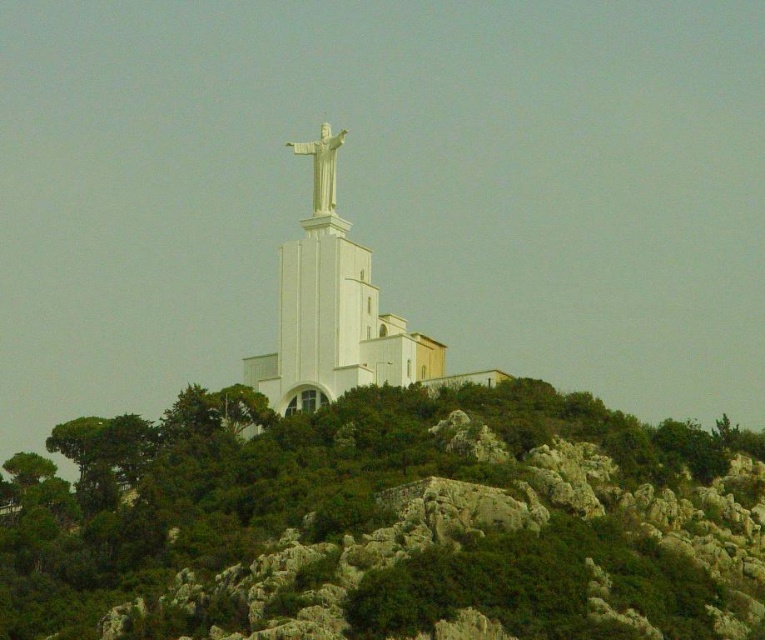
Question: Is white smooth statue at center below white marble statue at center?

Choices:
 (A) no
 (B) yes

Answer: (B)

Question: Which point is closer to the camera?

Choices:
 (A) white marble statue at center
 (B) white smooth statue at center
 (C) green leafy hillside at center

Answer: (C)

Question: Can you confirm if white smooth statue at center is positioned above white marble statue at center?

Choices:
 (A) yes
 (B) no

Answer: (B)

Question: Where is green leafy hillside at center located in relation to white marble statue at center in the image?

Choices:
 (A) above
 (B) below

Answer: (B)

Question: Considering the real-world distances, which object is farthest from the white marble statue at center?

Choices:
 (A) white smooth statue at center
 (B) green leafy hillside at center

Answer: (B)

Question: Among these objects, which one is farthest from the camera?

Choices:
 (A) white smooth statue at center
 (B) white marble statue at center

Answer: (B)